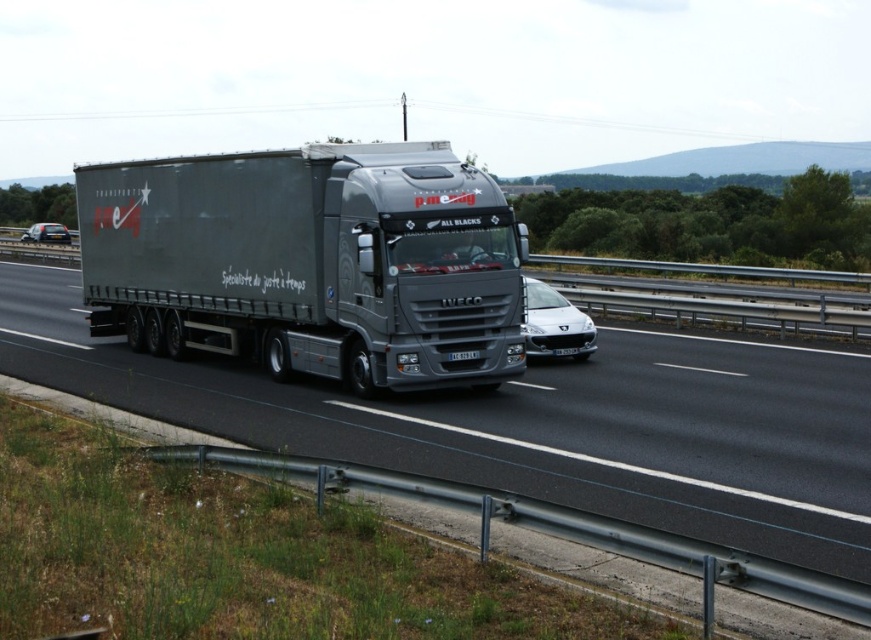
You are driving a car and see the metallic truck at center and the matte black trailer truck at left on the highway. Which vehicle is closer to you?

The metallic truck at center is closer to you because it is in front of the matte black trailer truck at left.

You are a GPS navigator and need to mark a point on the truck in the highway scene. The truck is a dark gray Iveco with a trailer and the point you need to mark is at coordinates point (534, 422). Is this point located on the metallic truck at center?

Yes, the point (534, 422) is on the metallic truck at center, so it is correctly marked there.

You are a driver approaching the highway and see the metallic truck at center and the matte black trailer truck at left. Which vehicle is blocking your view of the other?

The matte black trailer truck at left is blocking the view of the metallic truck at center because it is positioned above it.